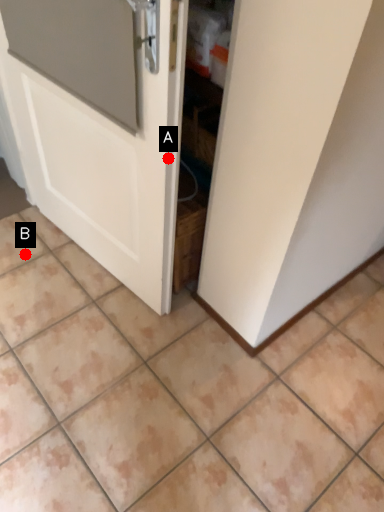
Question: Two points are circled on the image, labeled by A and B beside each circle. Which point is closer to the camera?

Choices:
 (A) A is closer
 (B) B is closer

Answer: (A)